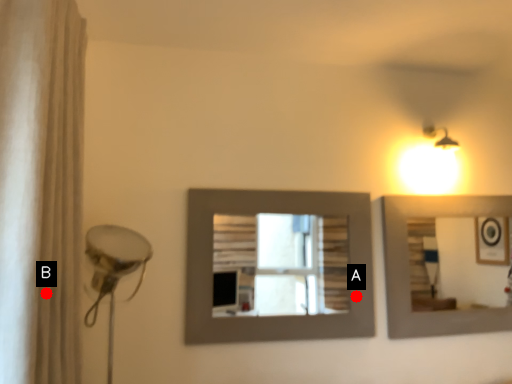
Question: Two points are circled on the image, labeled by A and B beside each circle. Which of the following is the closest to the observer?

Choices:
 (A) A is closer
 (B) B is closer

Answer: (B)